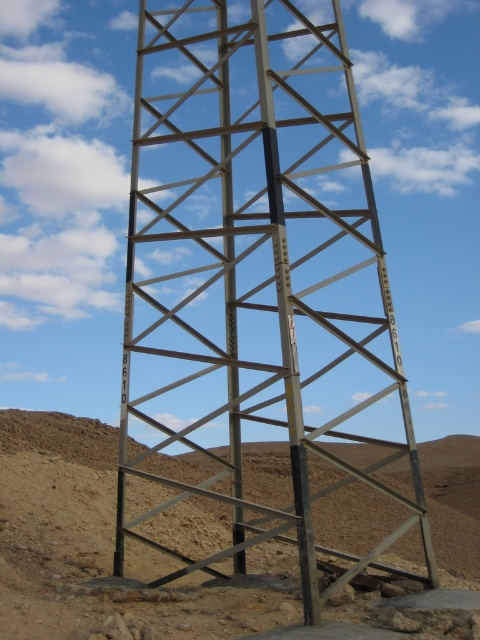
Question: Can you confirm if metallic structure at center is wider than brown sandy soil at center?

Choices:
 (A) no
 (B) yes

Answer: (A)

Question: Observing the image, what is the correct spatial positioning of metallic structure at center in reference to brown sandy soil at center?

Choices:
 (A) right
 (B) left

Answer: (B)

Question: Which point appears farthest from the camera in this image?

Choices:
 (A) (408, 570)
 (B) (288, 292)

Answer: (A)

Question: Which point is closer to the camera taking this photo?

Choices:
 (A) (x=116, y=540)
 (B) (x=188, y=500)

Answer: (A)

Question: Is metallic structure at center further to camera compared to brown sandy soil at center?

Choices:
 (A) no
 (B) yes

Answer: (B)